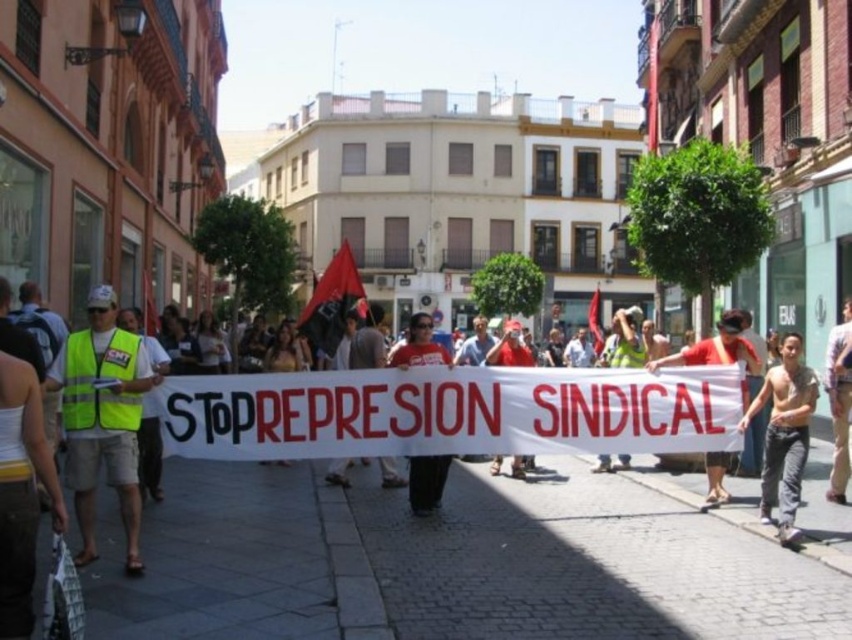
From the picture: You are a photographer trying to capture the protest scene. You notice the yellow reflective vest at left and the shiny black shirt at center. Which object should you focus on to ensure it appears larger in your photo?

The shiny black shirt at center is taller than the yellow reflective vest at left, so focusing on the shiny black shirt at center would make it appear larger in the photo.